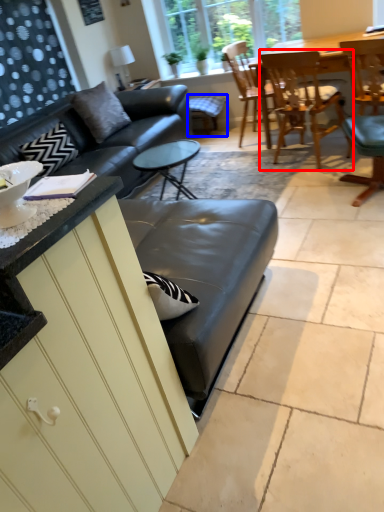
Question: Which object appears closest to the camera in this image, chair (highlighted by a red box) or bar stool (highlighted by a blue box)?

Choices:
 (A) chair
 (B) bar stool

Answer: (A)